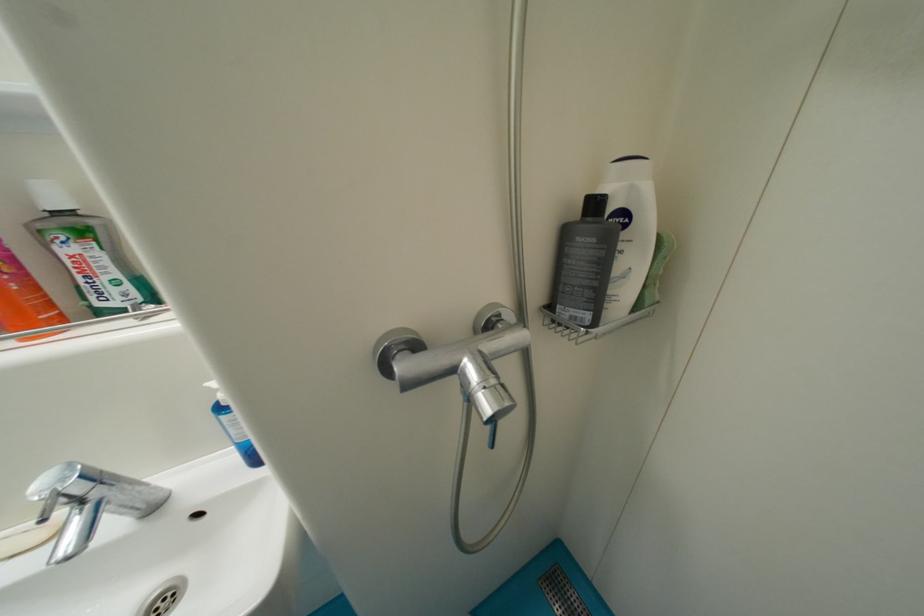
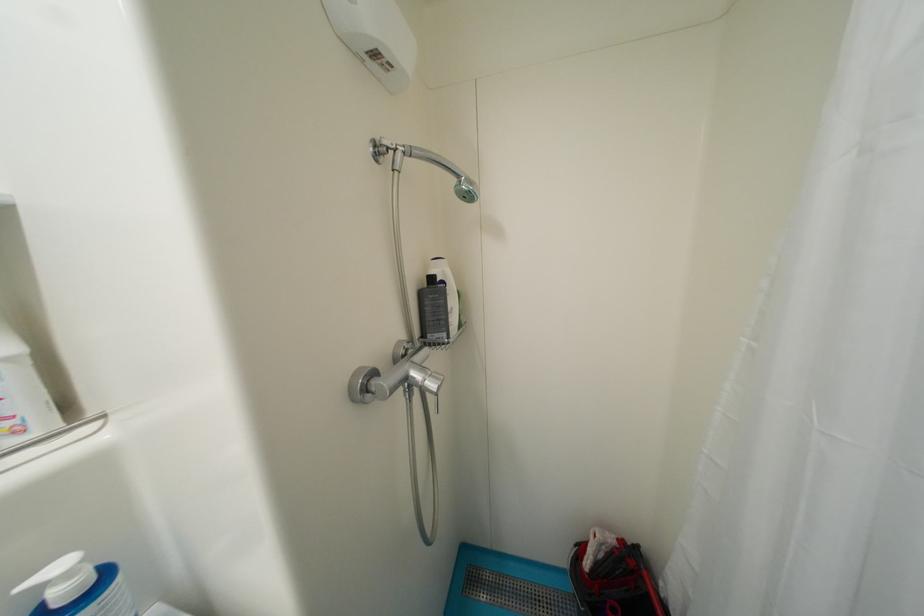
In the second image, find the point that corresponds to [406,354] in the first image.

(374, 383)